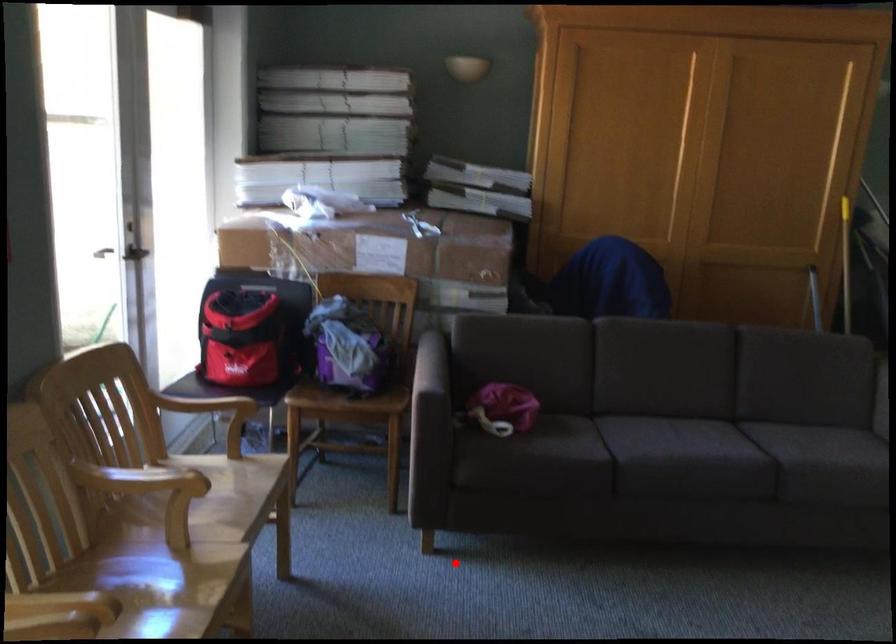
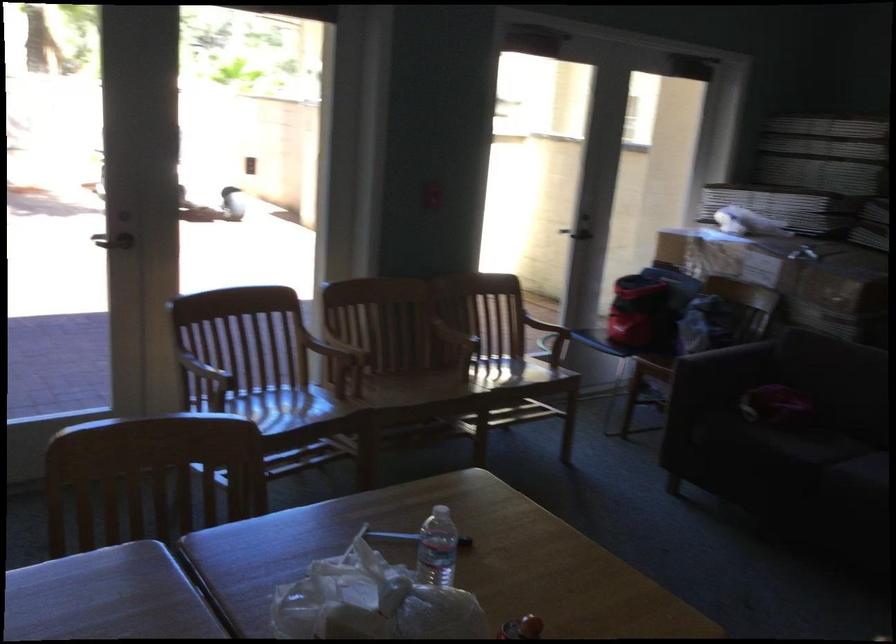
Question: I am providing you with two images of the same scene from different viewpoints. A red point is shown in image1. For the corresponding object point in image2, is it positioned nearer or farther from the camera?

Choices:
 (A) Nearer
 (B) Farther

Answer: (B)